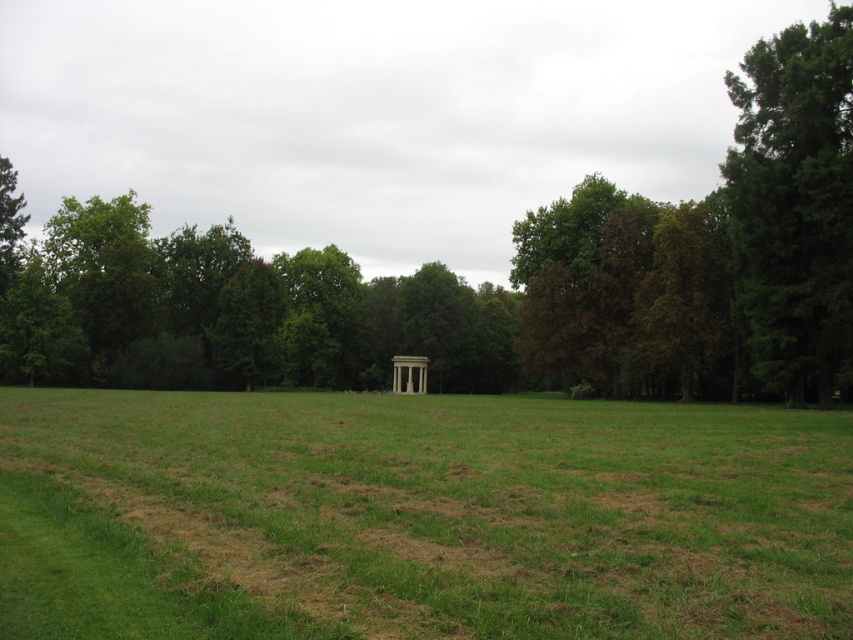
Does green grassy field at center appear over green coniferous tree at right?

Actually, green grassy field at center is below green coniferous tree at right.

Can you confirm if green grassy field at center is thinner than green coniferous tree at right?

Yes, green grassy field at center is thinner than green coniferous tree at right.

Does point (260, 595) come farther from viewer compared to point (764, 156)?

No, it is not.

Locate an element on the screen. green grassy field at center is located at coordinates (418, 516).

Can you confirm if green grassy field at center is positioned to the left of white marble gazebo at center?

Correct, you'll find green grassy field at center to the left of white marble gazebo at center.

The image size is (853, 640). Find the location of `green grassy field at center`. green grassy field at center is located at coordinates (418, 516).

Between green coniferous tree at right and white marble gazebo at center, which one has more height?

Standing taller between the two is green coniferous tree at right.

Can you confirm if green coniferous tree at right is thinner than white marble gazebo at center?

No.

At what (x,y) coordinates should I click in order to perform the action: click on green coniferous tree at right. Please return your answer as a coordinate pair (x, y). Looking at the image, I should click on (793, 204).